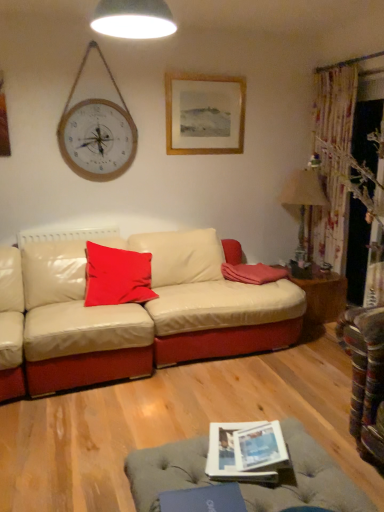
Where is `vacant region above wooden side table at right (from a real-world perspective)`? vacant region above wooden side table at right (from a real-world perspective) is located at coordinates (309, 269).